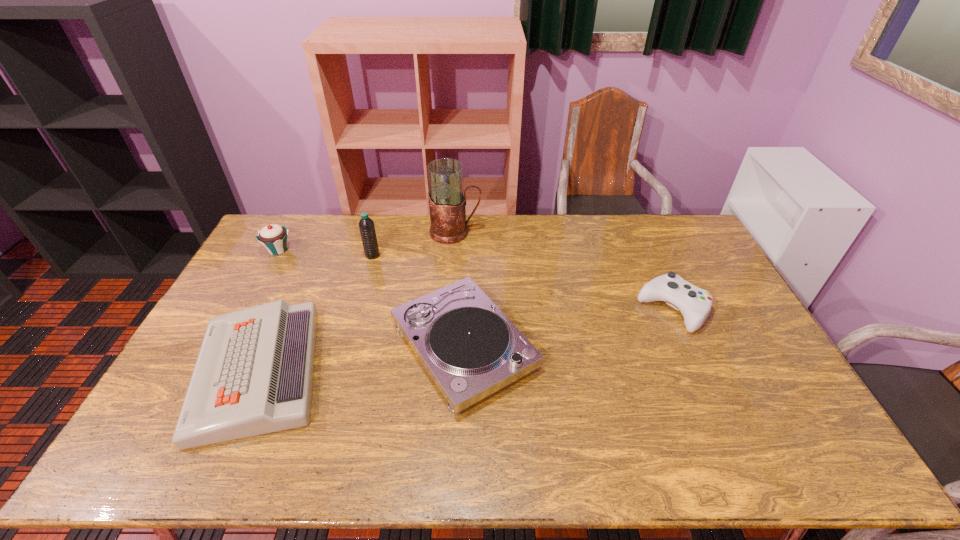
Where is `pitcher`? The image size is (960, 540). pitcher is located at coordinates (447, 200).

Find the location of `the fourth object from right to left`. the fourth object from right to left is located at coordinates (366, 225).

The image size is (960, 540). In order to click on water bottle in this screenshot , I will do [x=366, y=225].

Where is `cupcake`? The image size is (960, 540). cupcake is located at coordinates (273, 237).

The width and height of the screenshot is (960, 540). Identify the location of record player. (470, 349).

Locate an element on the screen. control is located at coordinates (694, 303).

The width and height of the screenshot is (960, 540). In order to click on computer keyboard in this screenshot , I will do `click(254, 373)`.

I want to click on vacant space located 0.240m with the handle on the side of the pitcher, so click(x=543, y=232).

Locate an element on the screen. The height and width of the screenshot is (540, 960). free space located 0.310m on the right of the water bottle is located at coordinates (465, 255).

Locate an element on the screen. Image resolution: width=960 pixels, height=540 pixels. vacant area situated 0.120m on the right of the fourth shortest object is located at coordinates (325, 250).